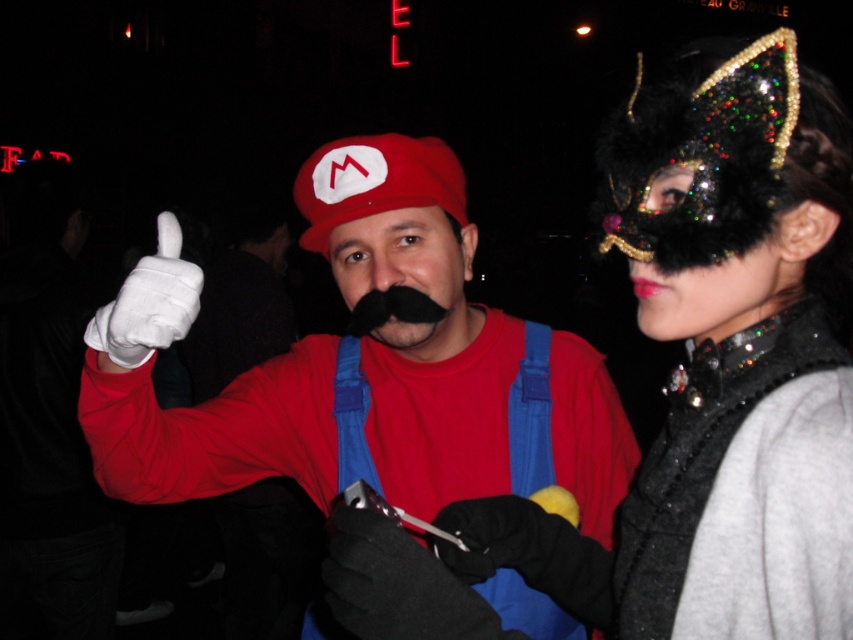
You are taking a photo of the two points in the scene. Which point, point (132, 304) or point (358, 314), will appear larger in your photo?

Point (132, 304) will appear larger in the photo because it is closer to the camera than point (358, 314).

You are at a costume party and need to decide which accessory to take first. You see the matte red cap at center and the black fuzzy mustache at center. Which accessory is bigger?

The matte red cap at center is larger in size than the black fuzzy mustache at center.

You are at a costume party and need to hang your items on a coat rack. The matte red cap at center and black leather gloves at center are both on the floor. Which item should you place higher on the rack to ensure they don t touch the ground?

The matte red cap at center should be placed higher on the rack because it is much taller than the black leather gloves at center, so placing it higher ensures both items won t touch the ground.